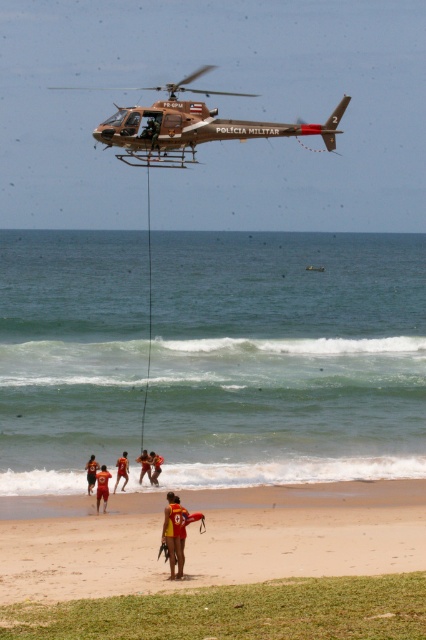
Does orange fabric shorts at lower center have a lesser height compared to red life vest at center?

In fact, orange fabric shorts at lower center may be taller than red life vest at center.

Is the position of orange fabric shorts at lower center less distant than that of red life vest at center?

Yes, orange fabric shorts at lower center is in front of red life vest at center.

Identify the location of orange fabric shorts at lower center. The width and height of the screenshot is (426, 640). [x=121, y=470].

Is yellow fabric at lower center behind red life vest at center?

That is False.

Does point (69, 540) come farther from viewer compared to point (146, 464)?

That is False.

From the picture: Who is more forward, (340, 538) or (147, 456)?

Positioned in front is point (340, 538).

You are a GUI agent. You are given a task and a screenshot of the screen. Output one action in this format:
    pyautogui.click(x=<x>, y=<y>)
    Task: Click on the yellow fabric at lower center
    
    Given the screenshot: What is the action you would take?
    pyautogui.click(x=218, y=564)

Which is more to the left, red life vest at lower left or red life vest at center?

red life vest at lower left

The width and height of the screenshot is (426, 640). I want to click on red life vest at lower left, so click(x=91, y=472).

Where is `red life vest at lower left`? The image size is (426, 640). red life vest at lower left is located at coordinates (91, 472).